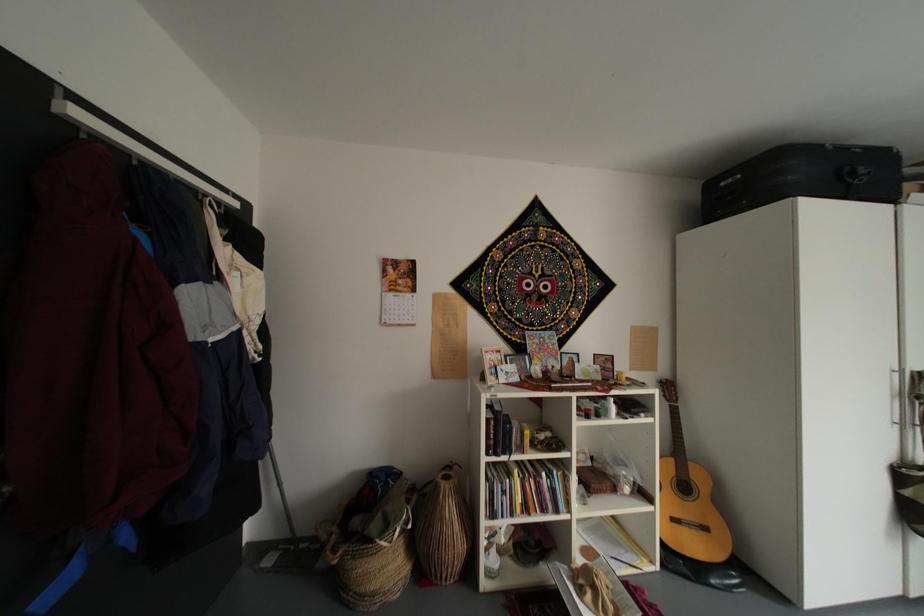
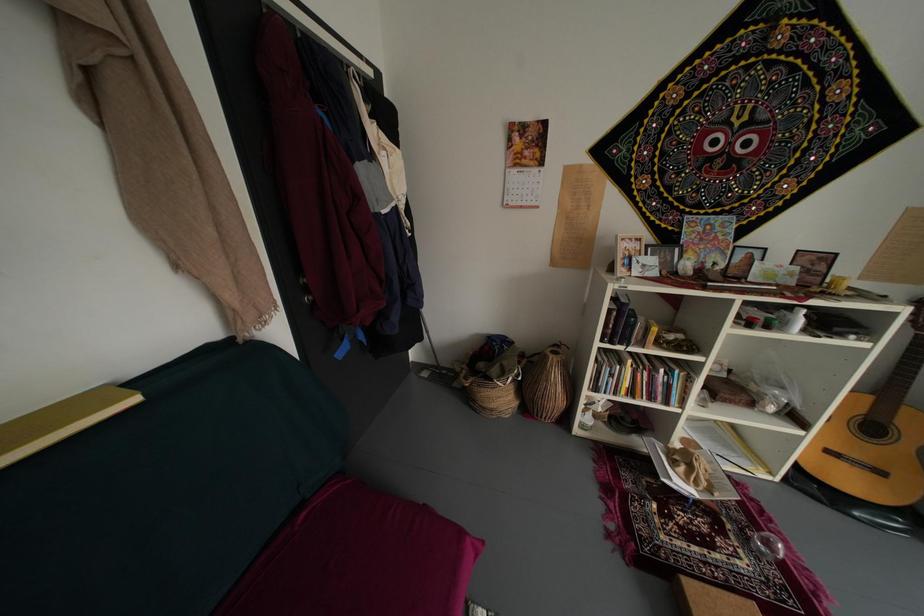
The first image is from the beginning of the video and the second image is from the end. How did the camera likely rotate when shooting the video?

The camera's rotation is toward left-down.